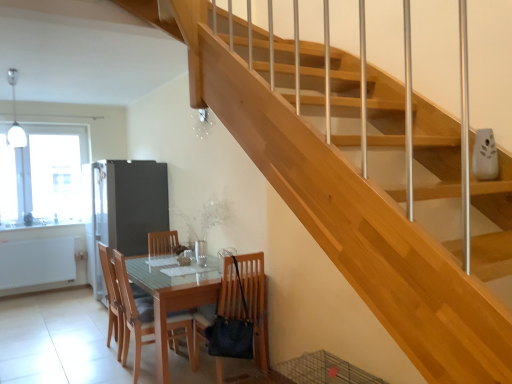
Question: Can you confirm if light brown wood chair at center, marked as the 2th chair in a right-to-left arrangement, is positioned to the right of transparent glass window at upper left?

Choices:
 (A) no
 (B) yes

Answer: (B)

Question: Can you confirm if light brown wood chair at center, which ranks as the 2th chair in left-to-right order, is smaller than transparent glass window at upper left?

Choices:
 (A) yes
 (B) no

Answer: (A)

Question: Considering the relative sizes of light brown wood chair at center, which ranks as the 2th chair in left-to-right order, and transparent glass window at upper left in the image provided, is light brown wood chair at center, which ranks as the 2th chair in left-to-right order, shorter than transparent glass window at upper left?

Choices:
 (A) yes
 (B) no

Answer: (A)

Question: Is transparent glass window at upper left located within light brown wood chair at center, marked as the 2th chair in a right-to-left arrangement?

Choices:
 (A) no
 (B) yes

Answer: (A)

Question: From a real-world perspective, is light brown wood chair at center, marked as the 2th chair in a right-to-left arrangement, below transparent glass window at upper left?

Choices:
 (A) no
 (B) yes

Answer: (B)

Question: From the image's perspective, is matte brown chair at lower center, placed as the 1th chair when sorted from right to left, located above or below light wood/wooden chair at lower left, which is the first chair from left to right?

Choices:
 (A) below
 (B) above

Answer: (B)

Question: Is point (200, 329) positioned closer to the camera than point (117, 360)?

Choices:
 (A) closer
 (B) farther

Answer: (A)

Question: In terms of height, does matte brown chair at lower center, acting as the 3th chair starting from the left, look taller or shorter compared to light wood/wooden chair at lower left, the third chair in the right-to-left sequence?

Choices:
 (A) short
 (B) tall

Answer: (B)

Question: From a real-world perspective, relative to light wood/wooden chair at lower left, which is the first chair from left to right, is matte brown chair at lower center, placed as the 1th chair when sorted from right to left, vertically above or below?

Choices:
 (A) above
 (B) below

Answer: (B)

Question: Does point (165, 228) appear closer or farther from the camera than point (123, 332)?

Choices:
 (A) farther
 (B) closer

Answer: (A)

Question: Looking at the image, does satin silver refrigerator at left seem bigger or smaller compared to light brown wood chair at center, which ranks as the 2th chair in left-to-right order?

Choices:
 (A) small
 (B) big

Answer: (B)

Question: From the image's perspective, is satin silver refrigerator at left located above or below light brown wood chair at center, marked as the 2th chair in a right-to-left arrangement?

Choices:
 (A) below
 (B) above

Answer: (B)

Question: From a real-world perspective, is satin silver refrigerator at left positioned above or below light brown wood chair at center, which ranks as the 2th chair in left-to-right order?

Choices:
 (A) above
 (B) below

Answer: (A)

Question: Is transparent glass window at upper left situated inside light brown wood chair at center, which ranks as the 2th chair in left-to-right order, or outside?

Choices:
 (A) outside
 (B) inside

Answer: (A)

Question: Based on their positions, is transparent glass window at upper left located to the left or right of light brown wood chair at center, which ranks as the 2th chair in left-to-right order?

Choices:
 (A) right
 (B) left

Answer: (B)